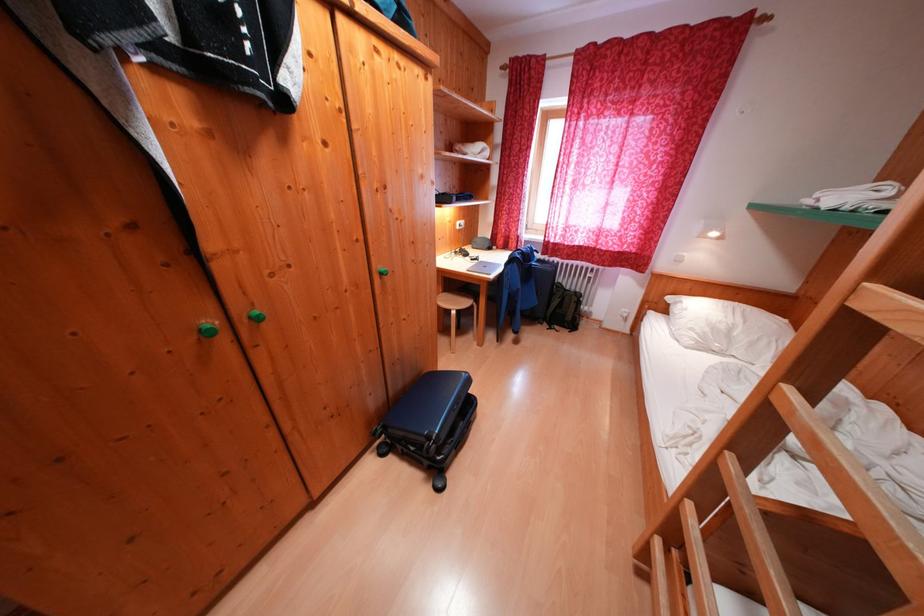
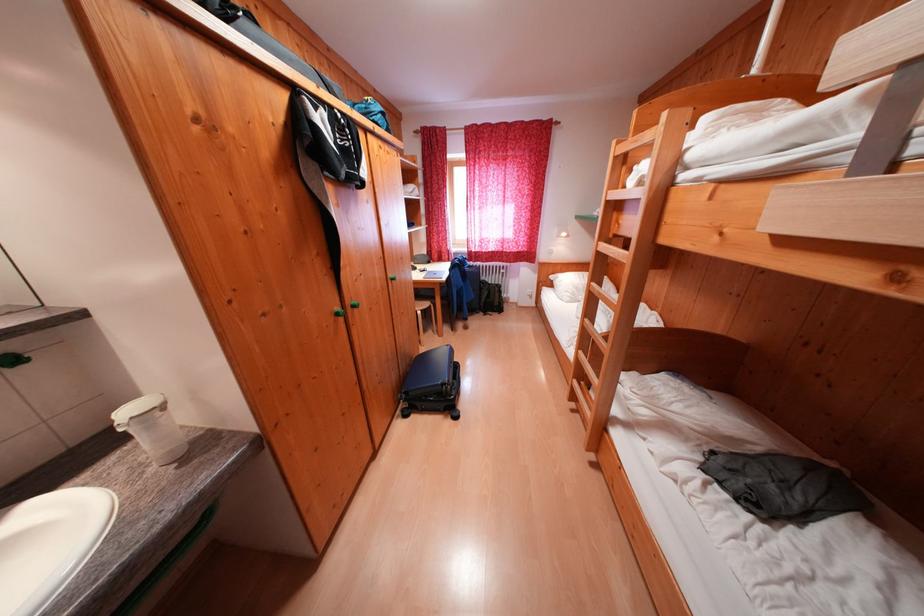
The point at (446, 439) is marked in the first image. Where is the corresponding point in the second image?

(456, 384)